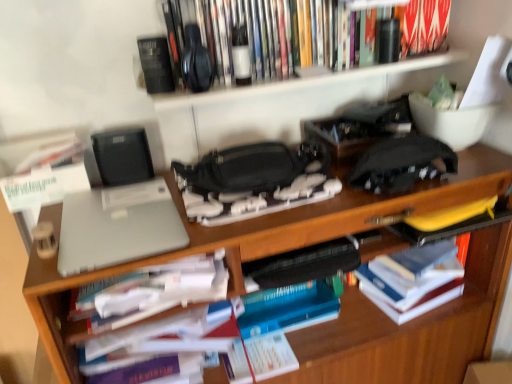
Locate an element on the screen. hardcover books at upper center, the third book in the bottom-to-top sequence is located at coordinates 294,35.

The image size is (512, 384). I want to click on white paper at center, so click(161, 317).

The image size is (512, 384). What do you see at coordinates (409, 290) in the screenshot? I see `hardcover book at right, the third book when ordered from top to bottom` at bounding box center [409, 290].

The width and height of the screenshot is (512, 384). Describe the element at coordinates (118, 226) in the screenshot. I see `sleek silver laptop at left` at that location.

This screenshot has height=384, width=512. I want to click on hardcover books at upper center, the 1th book from the top, so click(294, 35).

Is wooden bookshelf at upper center thinner than hardcover books at upper center, the 1th book from the top?

Incorrect, the width of wooden bookshelf at upper center is not less than that of hardcover books at upper center, the 1th book from the top.

Is wooden bookshelf at upper center spatially inside hardcover books at upper center, the 1th book from the top, or outside of it?

wooden bookshelf at upper center is inside hardcover books at upper center, the 1th book from the top.

Is wooden bookshelf at upper center in contact with hardcover books at upper center, the 1th book from the top?

Yes, wooden bookshelf at upper center is in contact with hardcover books at upper center, the 1th book from the top.

You are a GUI agent. You are given a task and a screenshot of the screen. Output one action in this format:
    pyautogui.click(x=<x>, y=<y>)
    Task: Click on the cabinet behind the matte gray laptop at center, marked as the 2th book in a top-to-bottom arrangement
    This screenshot has width=512, height=384.
    Given the screenshot: What is the action you would take?
    pyautogui.click(x=161, y=317)

Between matte gray laptop at center, marked as the 2th book in a top-to-bottom arrangement, and white paper at center, which one appears on the left side from the viewer's perspective?

matte gray laptop at center, marked as the 2th book in a top-to-bottom arrangement, is more to the left.

Is matte gray laptop at center, the 2th book when ordered from bottom to top, situated inside white paper at center or outside?

matte gray laptop at center, the 2th book when ordered from bottom to top, is not enclosed by white paper at center.

Does wooden bookshelf at upper center have a greater height compared to sleek silver laptop at left?

Correct, wooden bookshelf at upper center is much taller as sleek silver laptop at left.

How different are the orientations of wooden bookshelf at upper center and sleek silver laptop at left in degrees?

They differ by 2 degrees in their facing directions.

Is wooden bookshelf at upper center closer to camera compared to sleek silver laptop at left?

No, the depth of wooden bookshelf at upper center is greater than that of sleek silver laptop at left.

Measure the distance between wooden bookshelf at upper center and sleek silver laptop at left.

39.52 centimeters.

Who is bigger, sleek silver laptop at left or wooden desk at center?

wooden desk at center.

From a real-world perspective, is sleek silver laptop at left positioned above or below wooden desk at center?

In terms of real-world spatial position, sleek silver laptop at left is above wooden desk at center.

Would you say sleek silver laptop at left is to the left or to the right of wooden desk at center in the picture?

sleek silver laptop at left is positioned on wooden desk at center's left side.

Is hardcover book at right, the 1th book ordered from the bottom, surrounded by matte gray laptop at center, marked as the 2th book in a top-to-bottom arrangement?

No, matte gray laptop at center, marked as the 2th book in a top-to-bottom arrangement, does not contain hardcover book at right, the 1th book ordered from the bottom.

Is matte gray laptop at center, the 2th book when ordered from bottom to top, in contact with hardcover book at right, the 1th book ordered from the bottom?

They are not placed beside each other.

Is matte gray laptop at center, marked as the 2th book in a top-to-bottom arrangement, bigger than hardcover book at right, the 1th book ordered from the bottom?

Indeed, matte gray laptop at center, marked as the 2th book in a top-to-bottom arrangement, has a larger size compared to hardcover book at right, the 1th book ordered from the bottom.

From the image's perspective, which one is positioned lower, matte gray laptop at center, the 2th book when ordered from bottom to top, or hardcover book at right, the 1th book ordered from the bottom?

hardcover book at right, the 1th book ordered from the bottom, from the image's perspective.

Measure the distance between white paper at center and sleek silver laptop at left.

white paper at center and sleek silver laptop at left are 17.80 centimeters apart from each other.

Is sleek silver laptop at left at the back of white paper at center?

No, white paper at center is not facing the opposite direction of sleek silver laptop at left.

Considering the sizes of objects white paper at center and sleek silver laptop at left in the image provided, who is smaller, white paper at center or sleek silver laptop at left?

Smaller between the two is sleek silver laptop at left.

From the image's perspective, relative to white paper at center, is hardcover book at right, the 1th book ordered from the bottom, above or below?

From the image's perspective, hardcover book at right, the 1th book ordered from the bottom, appears above white paper at center.

Between hardcover book at right, the third book when ordered from top to bottom, and white paper at center, which one appears on the right side from the viewer's perspective?

From the viewer's perspective, hardcover book at right, the third book when ordered from top to bottom, appears more on the right side.

Consider the image. Is white paper at center at the back of hardcover book at right, the 1th book ordered from the bottom?

That's not correct — hardcover book at right, the 1th book ordered from the bottom, is not looking away from white paper at center.

Starting from the wooden bookshelf at upper center, which book is the 1st one to the left? Please provide its 2D coordinates.

[(294, 35)]

Where is `cabinet behind the matte gray laptop at center, marked as the 2th book in a top-to-bottom arrangement`? This screenshot has width=512, height=384. cabinet behind the matte gray laptop at center, marked as the 2th book in a top-to-bottom arrangement is located at coordinates (161, 317).

Estimate the real-world distances between objects in this image. Which object is closer to wooden desk at center, hardcover book at right, the third book when ordered from top to bottom, or sleek silver laptop at left?

hardcover book at right, the third book when ordered from top to bottom, is closer to wooden desk at center.

From the image, which object appears to be farther from hardcover book at right, the third book when ordered from top to bottom, sleek silver laptop at left or hardcover books at upper center, the third book in the bottom-to-top sequence?

sleek silver laptop at left is further to hardcover book at right, the third book when ordered from top to bottom.

Which object lies further to the anchor point white paper at center, sleek silver laptop at left or hardcover books at upper center, the 1th book from the top?

hardcover books at upper center, the 1th book from the top, is positioned further to the anchor white paper at center.

Based on their spatial positions, is white paper at center or wooden bookshelf at upper center further from matte gray laptop at center, marked as the 2th book in a top-to-bottom arrangement?

The object further to matte gray laptop at center, marked as the 2th book in a top-to-bottom arrangement, is wooden bookshelf at upper center.

Estimate the real-world distances between objects in this image. Which object is closer to matte gray laptop at center, the 2th book when ordered from bottom to top, hardcover book at right, the third book when ordered from top to bottom, or white paper at center?

Among the two, white paper at center is located nearer to matte gray laptop at center, the 2th book when ordered from bottom to top.

Looking at the image, which one is located further to matte gray laptop at center, the 2th book when ordered from bottom to top, hardcover book at right, the third book when ordered from top to bottom, or hardcover books at upper center, the 1th book from the top?

hardcover book at right, the third book when ordered from top to bottom, is positioned further to the anchor matte gray laptop at center, the 2th book when ordered from bottom to top.

From the image, which object appears to be farther from sleek silver laptop at left, matte gray laptop at center, the 2th book when ordered from bottom to top, or white paper at center?

white paper at center is further to sleek silver laptop at left.

When comparing their distances from matte gray laptop at center, the 2th book when ordered from bottom to top, does wooden bookshelf at upper center or hardcover books at upper center, the 1th book from the top, seem further?

hardcover books at upper center, the 1th book from the top, is positioned further to the anchor matte gray laptop at center, the 2th book when ordered from bottom to top.

Locate an element on the screen. The image size is (512, 384). cabinet located between sleek silver laptop at left and hardcover book at right, the 1th book ordered from the bottom, in the left-right direction is located at coordinates (161, 317).

I want to click on desk between sleek silver laptop at left and hardcover book at right, the third book when ordered from top to bottom, in the horizontal direction, so point(259,241).

Identify the location of cabinet between sleek silver laptop at left and wooden desk at center from left to right. (161, 317).

Locate an element on the screen. laptop between hardcover books at upper center, the third book in the bottom-to-top sequence, and wooden desk at center in the up-down direction is located at coordinates (118, 226).